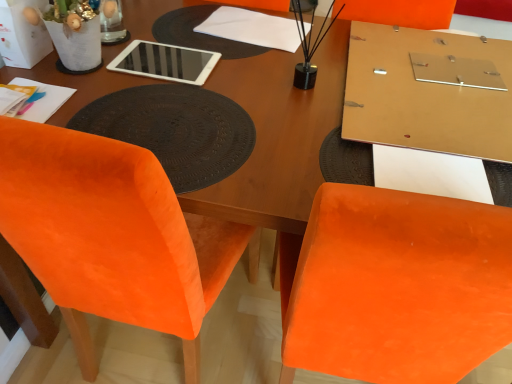
Question: Are white glossy tablet at upper center and white paper at center beside each other?

Choices:
 (A) yes
 (B) no

Answer: (B)

Question: From the image's perspective, is white glossy tablet at upper center below white paper at center?

Choices:
 (A) yes
 (B) no

Answer: (A)

Question: From a real-world perspective, is white glossy tablet at upper center physically above white paper at center?

Choices:
 (A) yes
 (B) no

Answer: (B)

Question: From the image's perspective, does white glossy tablet at upper center appear higher than white paper at center?

Choices:
 (A) yes
 (B) no

Answer: (B)

Question: Is white glossy tablet at upper center oriented away from white paper at center?

Choices:
 (A) yes
 (B) no

Answer: (A)

Question: Does white glossy tablet at upper center have a lesser height compared to white paper at center?

Choices:
 (A) yes
 (B) no

Answer: (B)

Question: From a real-world perspective, is white paper at center on top of white glossy tablet at upper center?

Choices:
 (A) yes
 (B) no

Answer: (A)

Question: Is white paper at center positioned before white glossy tablet at upper center?

Choices:
 (A) yes
 (B) no

Answer: (B)

Question: Can you confirm if white paper at center is taller than white glossy tablet at upper center?

Choices:
 (A) no
 (B) yes

Answer: (A)

Question: From the image's perspective, is white paper at center on top of white glossy tablet at upper center?

Choices:
 (A) no
 (B) yes

Answer: (B)

Question: Considering the relative sizes of white paper at center and white glossy tablet at upper center in the image provided, is white paper at center shorter than white glossy tablet at upper center?

Choices:
 (A) yes
 (B) no

Answer: (A)

Question: Is white paper at center thinner than white glossy tablet at upper center?

Choices:
 (A) no
 (B) yes

Answer: (A)

Question: Is velvet orange chair at lower left turned away from white paper bag at upper left?

Choices:
 (A) no
 (B) yes

Answer: (A)